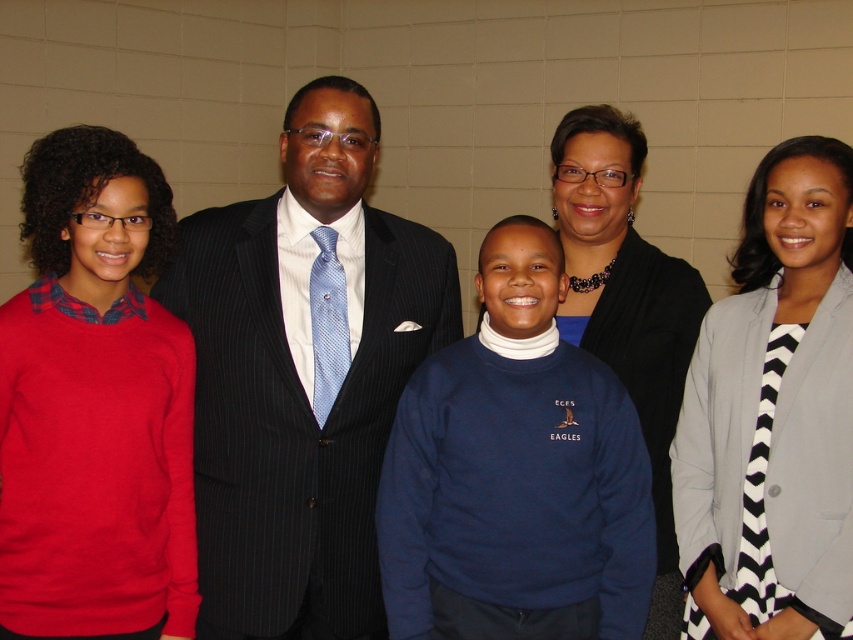
Does point (718, 602) come behind point (677, 580)?

No, it is in front of (677, 580).

Is point (808, 209) closer to viewer compared to point (660, 541)?

Yes.

This screenshot has height=640, width=853. I want to click on gray wool blazer at center, so click(x=775, y=412).

Is pinstriped suit at center further to the viewer compared to gray wool blazer at center?

Yes, pinstriped suit at center is further from the viewer.

Is pinstriped suit at center positioned in front of gray wool blazer at center?

No, it is behind gray wool blazer at center.

Does point (241, 428) come in front of point (740, 282)?

Yes, it is in front of point (740, 282).

Where is `pinstriped suit at center`? pinstriped suit at center is located at coordinates (302, 376).

Is navy blue sweater at center behind black matte sweater at center?

No, navy blue sweater at center is closer to the viewer.

Which is more to the left, navy blue sweater at center or black matte sweater at center?

Positioned to the left is navy blue sweater at center.

Who is more distant from viewer, [566,604] or [618,291]?

Point [618,291]

At what (x,y) coordinates should I click in order to perform the action: click on navy blue sweater at center. Please return your answer as a coordinate pair (x, y). This screenshot has height=640, width=853. Looking at the image, I should click on (515, 474).